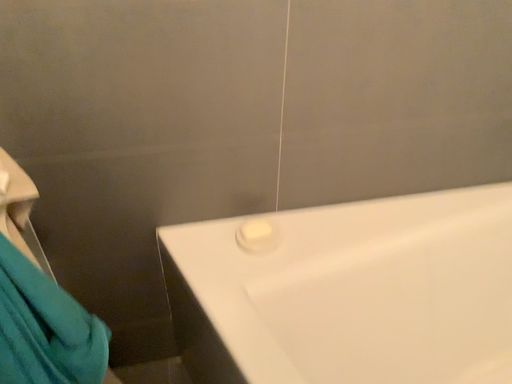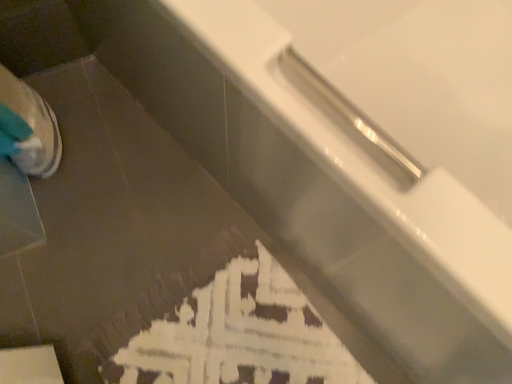
Question: Which way did the camera rotate in the video?

Choices:
 (A) rotated downward
 (B) rotated upward

Answer: (A)